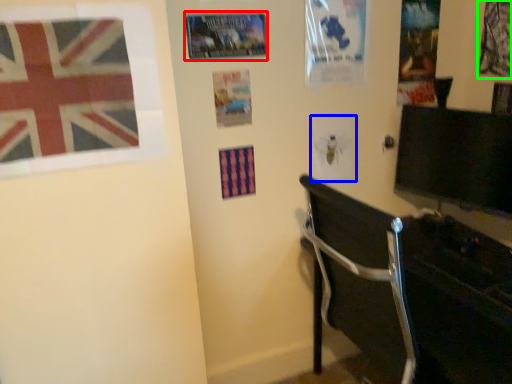
Question: Considering the real-world distances, which object is farthest from poster page (highlighted by a red box)? poster page (highlighted by a blue box) or poster page (highlighted by a green box)?

Choices:
 (A) poster page
 (B) poster page

Answer: (B)